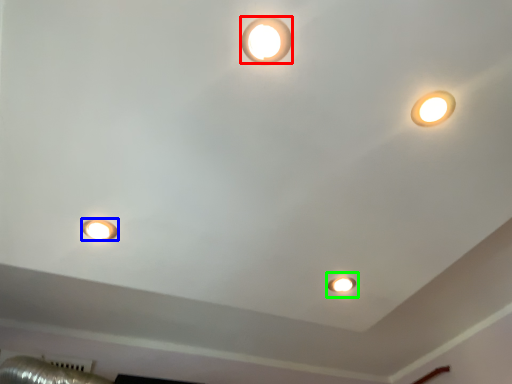
Question: Based on their relative distances, which object is nearer to lamp (highlighted by a red box)? Choose from lamp (highlighted by a blue box) and stage light (highlighted by a green box).

Choices:
 (A) lamp
 (B) stage light

Answer: (A)